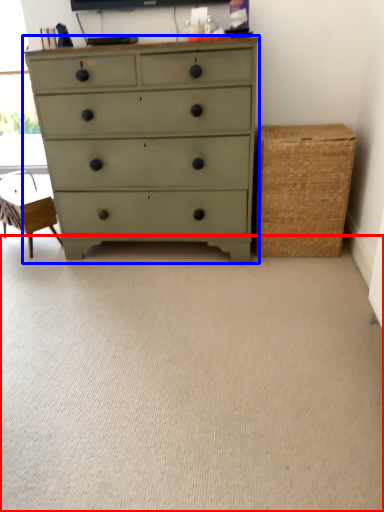
Question: Which object is further to the camera taking this photo, plain (highlighted by a red box) or chest of drawers (highlighted by a blue box)?

Choices:
 (A) plain
 (B) chest of drawers

Answer: (B)